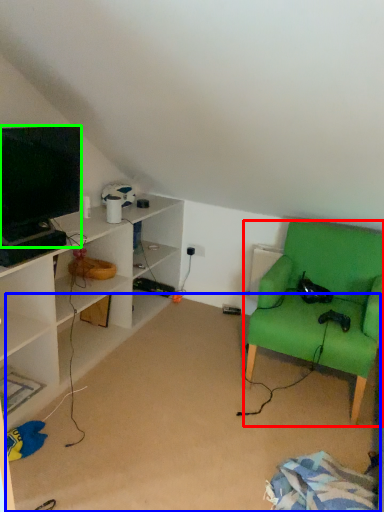
Question: Which is nearer to the chair (highlighted by a red box)? plain (highlighted by a blue box) or television (highlighted by a green box).

Choices:
 (A) plain
 (B) television

Answer: (A)